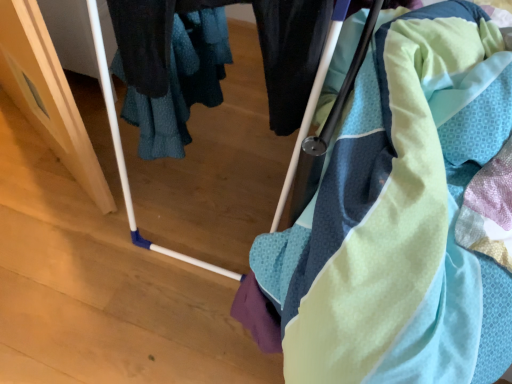
Question: In terms of size, does textured cotton towel at center appear bigger or smaller than matte plastic baby carriage at center?

Choices:
 (A) small
 (B) big

Answer: (A)

Question: Is point (426, 82) closer or farther from the camera than point (308, 127)?

Choices:
 (A) farther
 (B) closer

Answer: (B)

Question: Is textured cotton towel at center spatially inside matte plastic baby carriage at center, or outside of it?

Choices:
 (A) inside
 (B) outside

Answer: (B)

Question: Relative to textured cotton towel at center, is matte plastic baby carriage at center in front or behind?

Choices:
 (A) behind
 (B) front

Answer: (B)

Question: Which is correct: matte plastic baby carriage at center is inside textured cotton towel at center, or outside of it?

Choices:
 (A) inside
 (B) outside

Answer: (B)

Question: Considering the positions of point (290, 177) and point (397, 142), is point (290, 177) closer or farther from the camera than point (397, 142)?

Choices:
 (A) farther
 (B) closer

Answer: (A)

Question: From a real-world perspective, relative to textured cotton towel at center, is matte plastic baby carriage at center vertically above or below?

Choices:
 (A) below
 (B) above

Answer: (B)